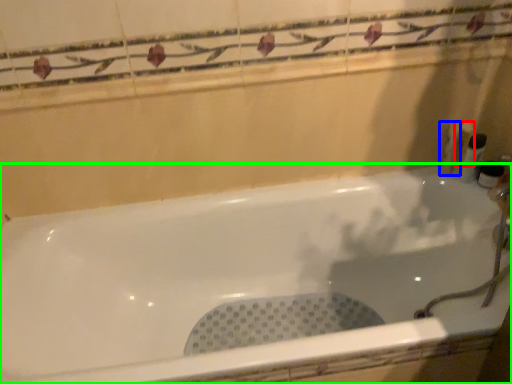
Question: Which object is positioned farthest from toiletry (highlighted by a red box)? Select from toiletry (highlighted by a blue box) and bathtub (highlighted by a green box).

Choices:
 (A) toiletry
 (B) bathtub

Answer: (B)